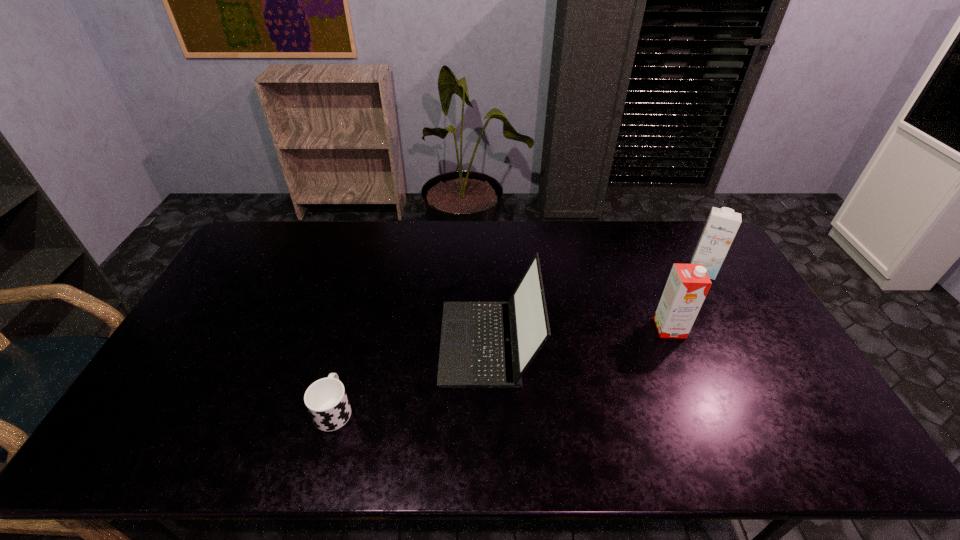
Where is `vacant area at the near edge of the desktop`? The width and height of the screenshot is (960, 540). vacant area at the near edge of the desktop is located at coordinates (527, 453).

What are the coordinates of `blank space at the right edge of the desktop` in the screenshot? It's located at (773, 341).

This screenshot has width=960, height=540. Identify the location of vacant space that's between the second object from left to right and the cup. (412, 376).

At what (x,y) coordinates should I click in order to perform the action: click on unoccupied position between the left carton and the third object from right to left. Please return your answer as a coordinate pair (x, y). The height and width of the screenshot is (540, 960). Looking at the image, I should click on (579, 335).

Where is `empty location between the right carton and the laptop`? This screenshot has height=540, width=960. empty location between the right carton and the laptop is located at coordinates (596, 306).

Locate an element on the screen. unoccupied area between the shortest object and the laptop is located at coordinates pyautogui.click(x=412, y=376).

The image size is (960, 540). I want to click on object that is the nearest to the nearest object, so click(x=483, y=344).

At what (x,y) coordinates should I click in order to perform the action: click on object identified as the third closest to the farther carton. Please return your answer as a coordinate pair (x, y). This screenshot has width=960, height=540. Looking at the image, I should click on (326, 400).

At what (x,y) coordinates should I click in order to perform the action: click on free space that satisfies the following two spatial constraints: 1. on the front side of the nearer carton; 2. on the surface of the third object from right to left. Please return your answer as a coordinate pair (x, y). Looking at the image, I should click on (676, 342).

Locate an element on the screen. vacant space that satisfies the following two spatial constraints: 1. on the side of the cup with the handle; 2. on the right side of the second object from right to left is located at coordinates click(356, 328).